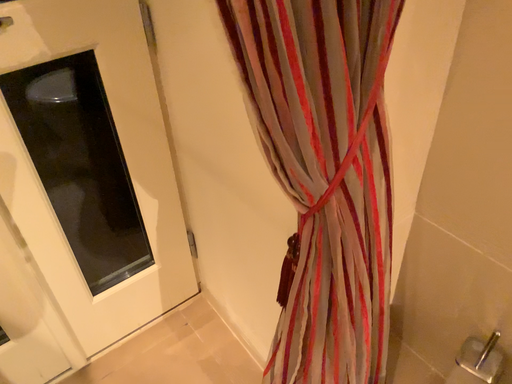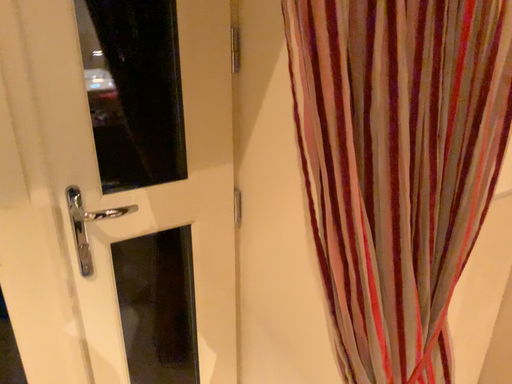
Question: Which way did the camera rotate in the video?

Choices:
 (A) rotated upward
 (B) rotated downward

Answer: (A)